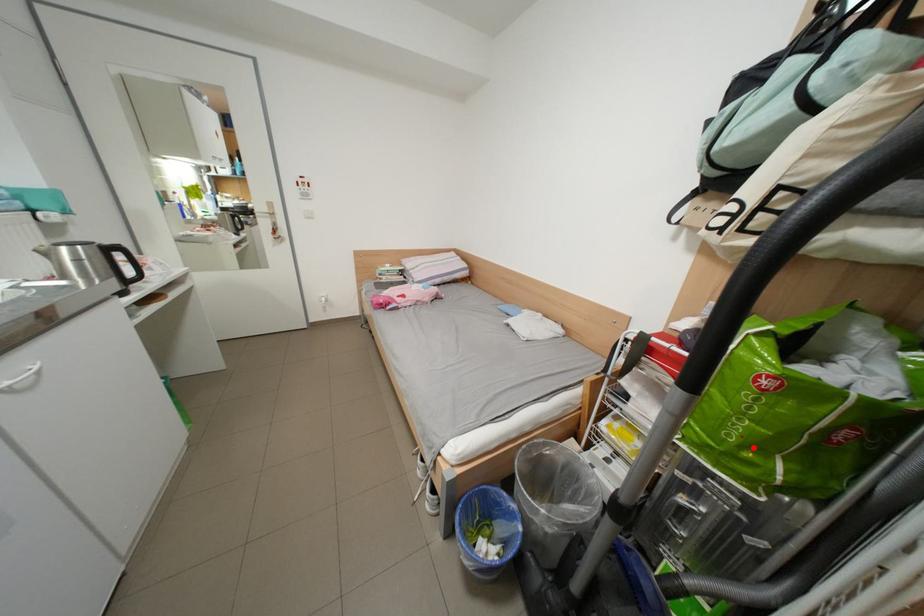
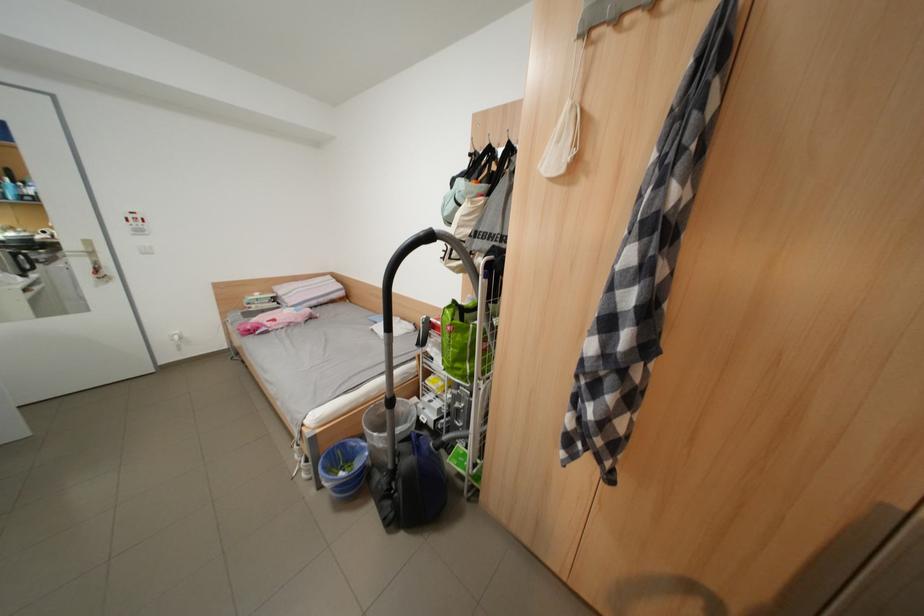
Locate, in the second image, the point that corresponds to the highlighted location in the first image.

(466, 363)